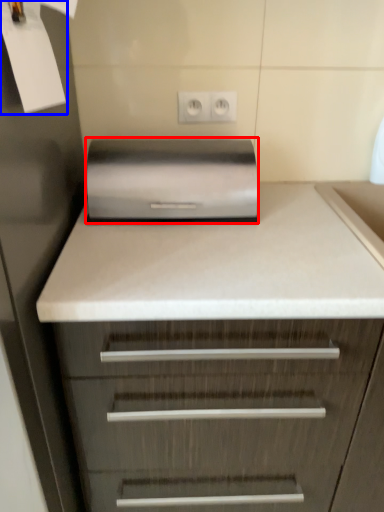
Question: Which point is closer to the camera, home appliance (highlighted by a red box) or paper (highlighted by a blue box)?

Choices:
 (A) home appliance
 (B) paper

Answer: (B)